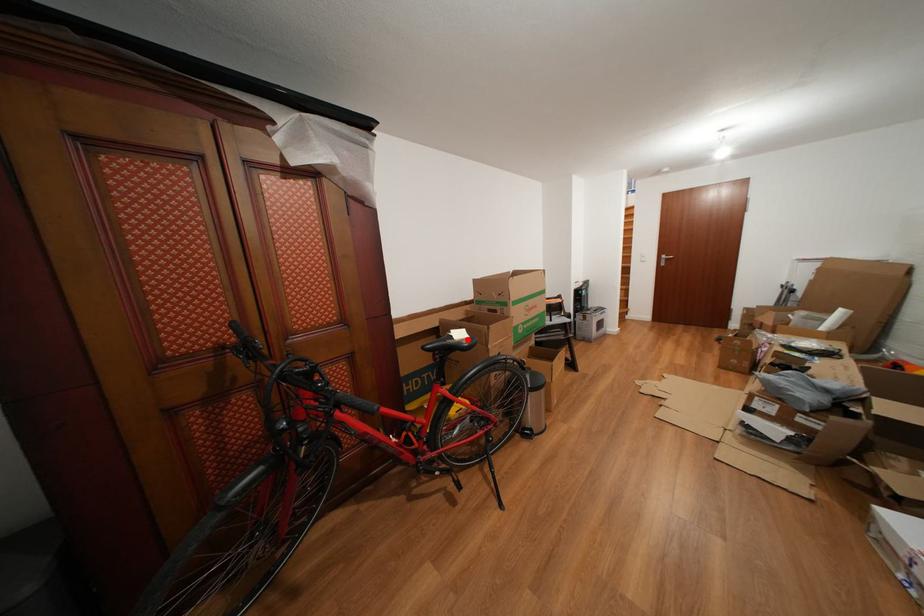
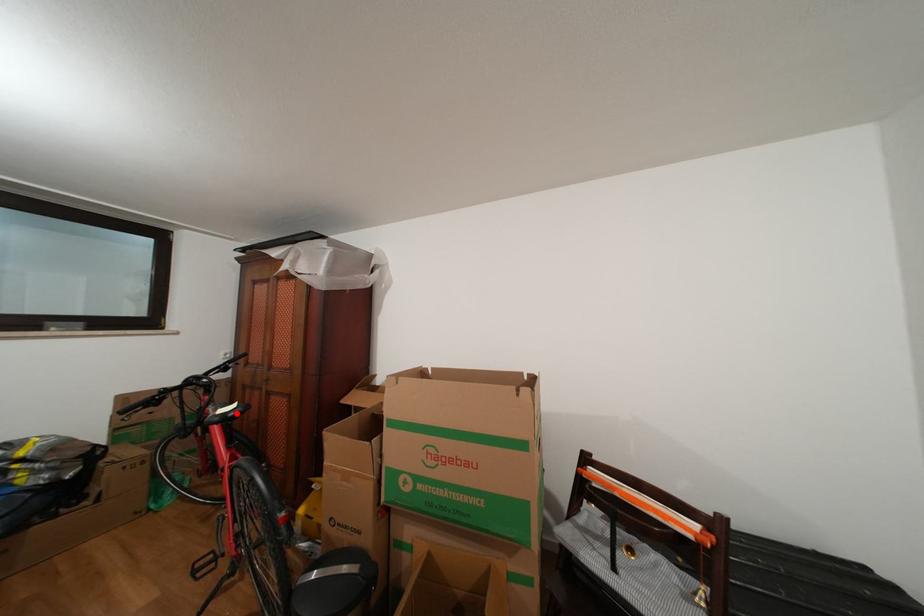
I am providing you with two images of the same scene from different viewpoints. A red point is marked on the first image and another point is marked on the second image. Are the points marked in image1 and image2 representing the same 3D position?

→ Yes